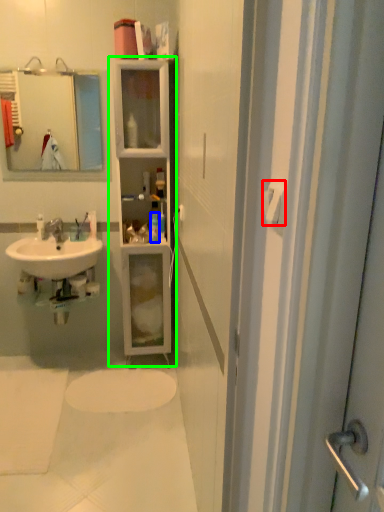
Question: Estimate the real-world distances between objects in this image. Which object is closer to towel bar (highlighted by a red box), toiletry (highlighted by a blue box) or bathroom cabinet (highlighted by a green box)?

Choices:
 (A) toiletry
 (B) bathroom cabinet

Answer: (A)